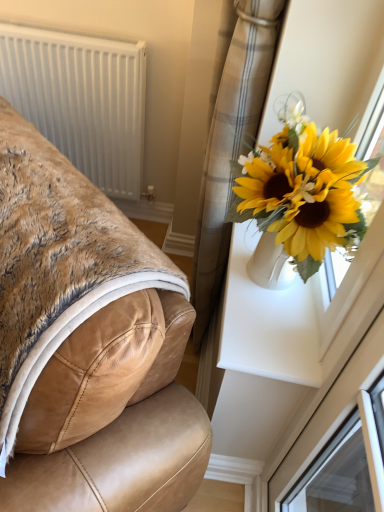
Question: Does tan leather chair at left have a greater height compared to white plastic radiator at upper left?

Choices:
 (A) yes
 (B) no

Answer: (B)

Question: Is tan leather chair at left closer to the viewer compared to white plastic radiator at upper left?

Choices:
 (A) no
 (B) yes

Answer: (B)

Question: From a real-world perspective, is tan leather chair at left beneath white plastic radiator at upper left?

Choices:
 (A) yes
 (B) no

Answer: (B)

Question: From the image's perspective, is tan leather chair at left beneath white plastic radiator at upper left?

Choices:
 (A) no
 (B) yes

Answer: (B)

Question: Is tan leather chair at left next to white plastic radiator at upper left and touching it?

Choices:
 (A) no
 (B) yes

Answer: (A)

Question: Relative to tan leather chair at left, is plaid fabric curtain at upper right in front or behind?

Choices:
 (A) front
 (B) behind

Answer: (B)

Question: Considering the positions of plaid fabric curtain at upper right and tan leather chair at left in the image, is plaid fabric curtain at upper right bigger or smaller than tan leather chair at left?

Choices:
 (A) small
 (B) big

Answer: (A)

Question: In terms of width, does plaid fabric curtain at upper right look wider or thinner when compared to tan leather chair at left?

Choices:
 (A) thin
 (B) wide

Answer: (A)

Question: Visually, is plaid fabric curtain at upper right positioned to the left or to the right of tan leather chair at left?

Choices:
 (A) left
 (B) right

Answer: (B)

Question: Visually, is tan leather chair at left positioned to the left or to the right of white plastic radiator at upper left?

Choices:
 (A) left
 (B) right

Answer: (B)

Question: From their relative heights in the image, would you say tan leather chair at left is taller or shorter than white plastic radiator at upper left?

Choices:
 (A) short
 (B) tall

Answer: (A)

Question: In terms of width, does tan leather chair at left look wider or thinner when compared to white plastic radiator at upper left?

Choices:
 (A) wide
 (B) thin

Answer: (A)

Question: Based on their sizes in the image, would you say tan leather chair at left is bigger or smaller than white plastic radiator at upper left?

Choices:
 (A) small
 (B) big

Answer: (B)

Question: Considering the positions of plaid fabric curtain at upper right and white plastic radiator at upper left in the image, is plaid fabric curtain at upper right bigger or smaller than white plastic radiator at upper left?

Choices:
 (A) small
 (B) big

Answer: (A)

Question: From the image's perspective, relative to white plastic radiator at upper left, is plaid fabric curtain at upper right above or below?

Choices:
 (A) above
 (B) below

Answer: (B)